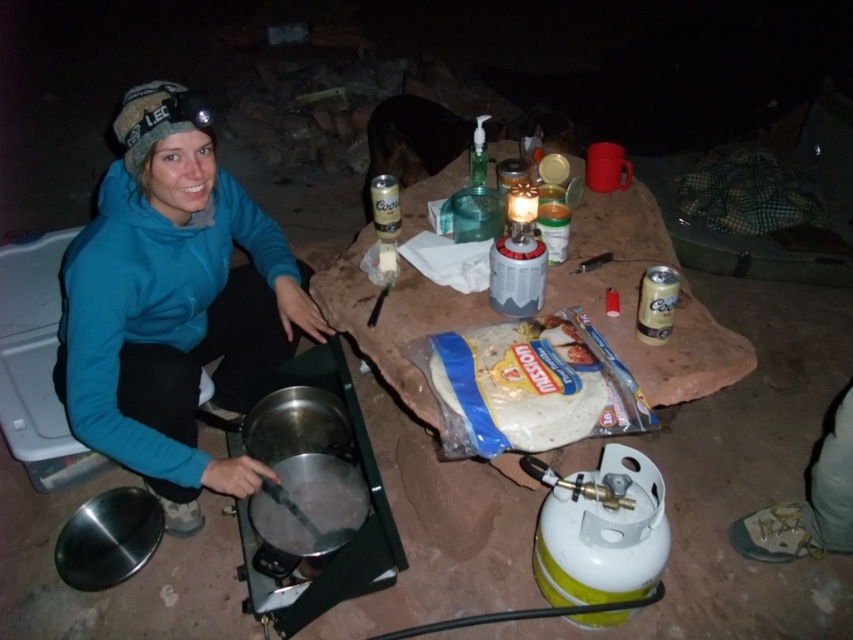
Between blue fleece jacket at center and white plastic tortillas at center, which one has less height?

white plastic tortillas at center

You are a GUI agent. You are given a task and a screenshot of the screen. Output one action in this format:
    pyautogui.click(x=<x>, y=<y>)
    Task: Click on the blue fleece jacket at center
    
    Given the screenshot: What is the action you would take?
    pyautogui.click(x=172, y=304)